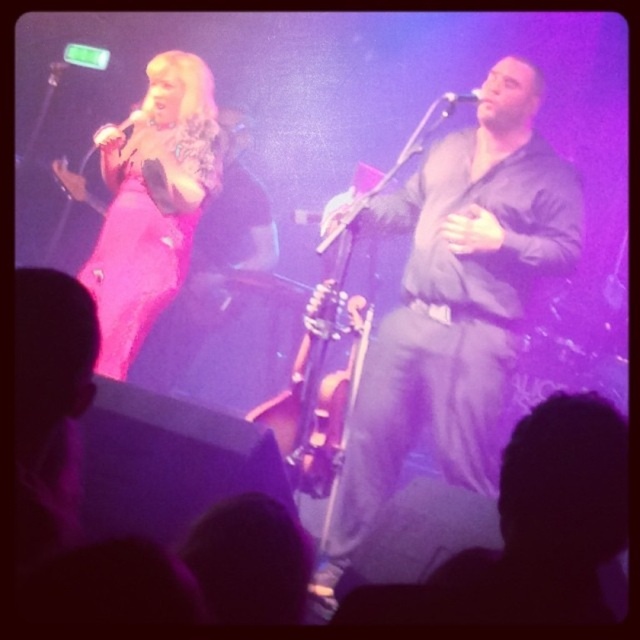
Is matte black shirt at center further to the viewer compared to metallic silver microphone at upper left?

No.

Measure the distance between matte black shirt at center and metallic silver microphone at upper left.

4.52 feet

Where is `matte black shirt at center`? This screenshot has height=640, width=640. matte black shirt at center is located at coordinates (456, 301).

Is the position of shiny pink dress at upper left less distant than that of metallic silver microphone at upper center?

No, it is not.

Who is more distant from viewer, (164, 154) or (468, 97)?

Positioned behind is point (164, 154).

Measure the distance between point [128,248] and camera.

Point [128,248] and camera are 2.70 meters apart from each other.

Where is `shiny pink dress at upper left`? shiny pink dress at upper left is located at coordinates (152, 205).

Is matte black shirt at center positioned behind shiny pink dress at upper left?

No.

Is point (451, 426) positioned after point (125, 211)?

No, (451, 426) is closer to viewer.

You are a GUI agent. You are given a task and a screenshot of the screen. Output one action in this format:
    pyautogui.click(x=<x>, y=<y>)
    Task: Click on the matte black shirt at center
    This screenshot has height=640, width=640.
    Given the screenshot: What is the action you would take?
    pyautogui.click(x=456, y=301)